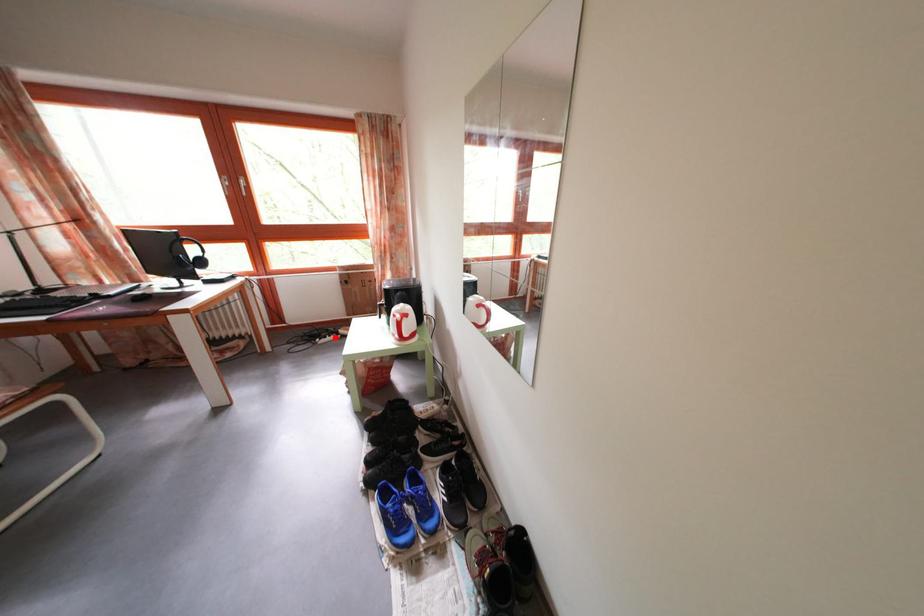
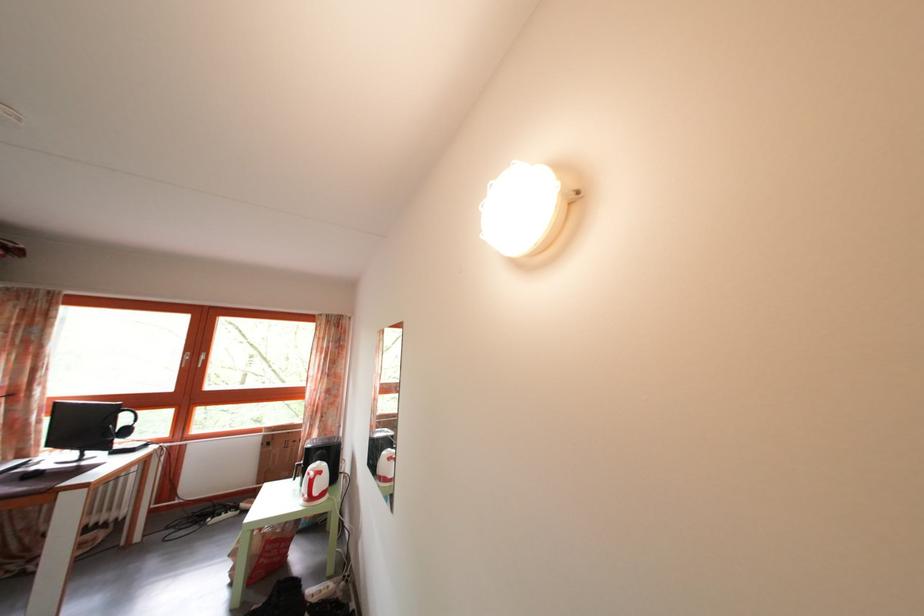
Question: I am providing you with two images of the same scene from different viewpoints. Image1 has a red point marked. In image2, the corresponding 3D location appears at what relative position? Reply with the corresponding letter.

Choices:
 (A) Closer
 (B) Farther

Answer: (A)